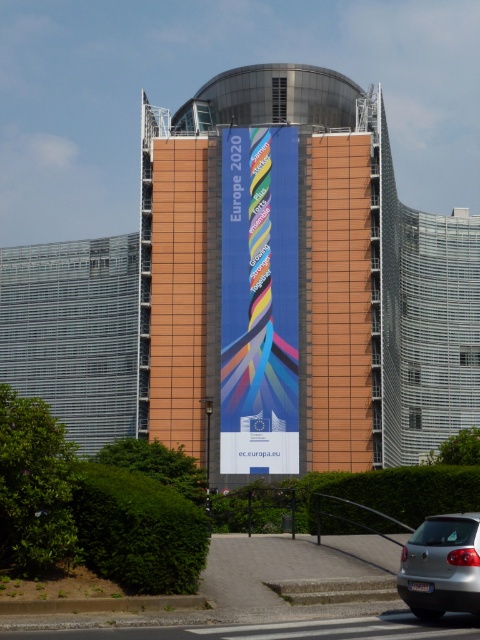
Question: Among these objects, which one is nearest to the camera?

Choices:
 (A) satin silver sedan at lower right
 (B) blue fabric banner at center

Answer: (A)

Question: Is blue fabric banner at center wider than satin silver sedan at lower right?

Choices:
 (A) no
 (B) yes

Answer: (B)

Question: Which object appears closest to the camera in this image?

Choices:
 (A) satin silver sedan at lower right
 (B) blue fabric banner at center

Answer: (A)

Question: Is blue fabric banner at center wider than satin silver sedan at lower right?

Choices:
 (A) yes
 (B) no

Answer: (A)

Question: Does blue fabric banner at center appear over satin silver sedan at lower right?

Choices:
 (A) no
 (B) yes

Answer: (B)